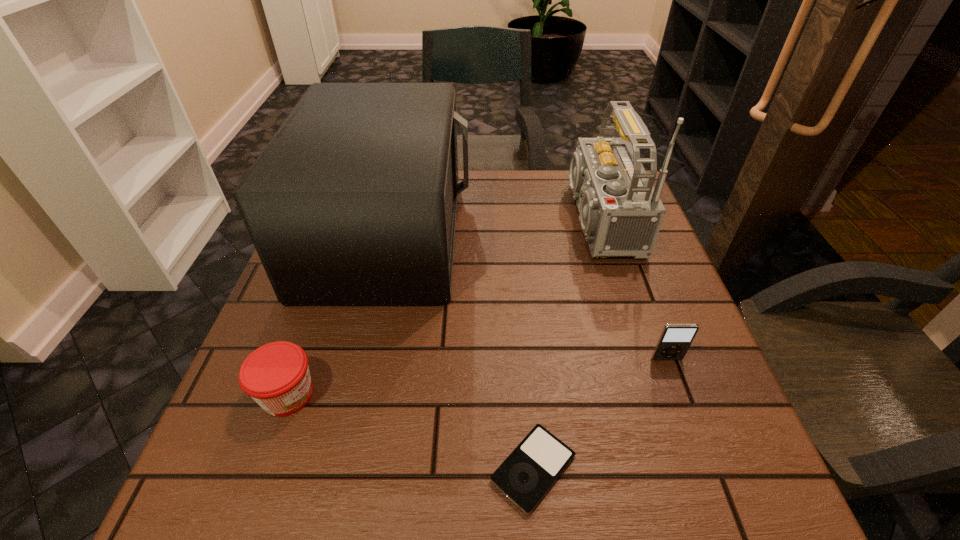
The image size is (960, 540). I want to click on radio receiver, so click(x=621, y=213).

The image size is (960, 540). Find the location of `microwave oven`. microwave oven is located at coordinates (353, 202).

The width and height of the screenshot is (960, 540). Identify the location of the third nearest object. (675, 339).

The height and width of the screenshot is (540, 960). In order to click on the farther iPod in this screenshot , I will do `click(675, 339)`.

Identify the location of jam. (276, 375).

The width and height of the screenshot is (960, 540). What are the coordinates of `the shorter iPod` in the screenshot? It's located at pyautogui.click(x=526, y=475).

You are a GUI agent. You are given a task and a screenshot of the screen. Output one action in this format:
    pyautogui.click(x=<x>, y=<y>)
    Task: Click on the left iPod
    
    Given the screenshot: What is the action you would take?
    pyautogui.click(x=526, y=475)

You are a GUI agent. You are given a task and a screenshot of the screen. Output one action in this format:
    pyautogui.click(x=<x>, y=<y>)
    Task: Click on the free point located 0.270m on the front-facing side of the radio receiver
    
    Given the screenshot: What is the action you would take?
    pyautogui.click(x=449, y=219)

This screenshot has height=540, width=960. In order to click on blank space located on the front-facing side of the radio receiver in this screenshot , I will do `click(414, 219)`.

I want to click on vacant space located on the front-facing side of the radio receiver, so click(425, 219).